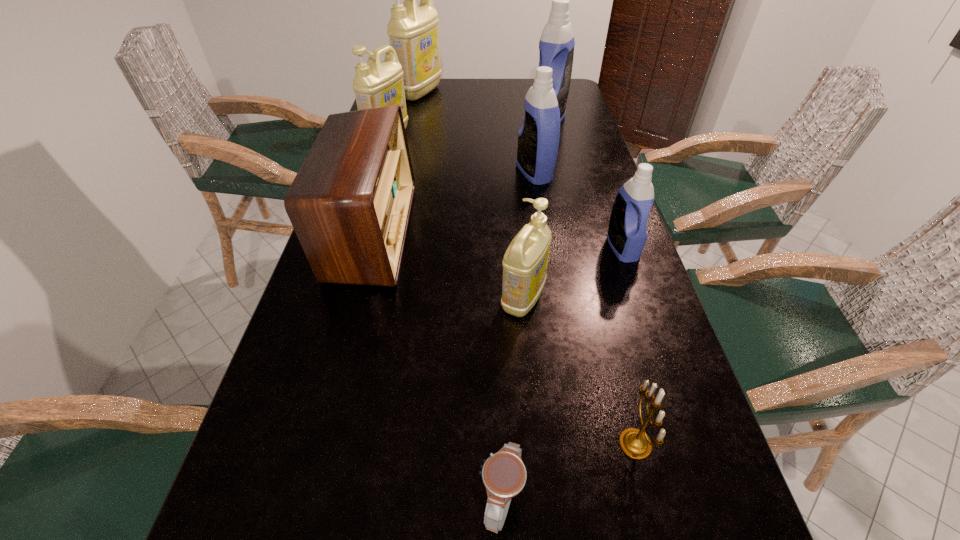
Select which blue detergent appears as the third closest to the second farthest beige detergent. Please provide its 2D coordinates. Your answer should be formatted as a tuple, i.e. [(x, y)], where the tuple contains the x and y coordinates of a point satisfying the conditions above.

[(627, 234)]

Identify which blue detergent is the closest to the candelabrum. Please provide its 2D coordinates. Your answer should be formatted as a tuple, i.e. [(x, y)], where the tuple contains the x and y coordinates of a point satisfying the conditions above.

[(627, 234)]

Where is `vacant region that satisfies the following two spatial constraints: 1. on the back side of the second smallest blue detergent; 2. on the right side of the nearest beige detergent`? This screenshot has width=960, height=540. vacant region that satisfies the following two spatial constraints: 1. on the back side of the second smallest blue detergent; 2. on the right side of the nearest beige detergent is located at coordinates (512, 173).

Where is `vacant space that satisfies the following two spatial constraints: 1. on the front side of the gold candelabrum; 2. on the right side of the second smallest blue detergent`? This screenshot has width=960, height=540. vacant space that satisfies the following two spatial constraints: 1. on the front side of the gold candelabrum; 2. on the right side of the second smallest blue detergent is located at coordinates (578, 443).

At what (x,y) coordinates should I click in order to perform the action: click on free space that satisfies the following two spatial constraints: 1. on the front side of the second farthest blue detergent; 2. on the right side of the second biggest beige detergent. Please return your answer as a coordinate pair (x, y). The height and width of the screenshot is (540, 960). Looking at the image, I should click on (376, 173).